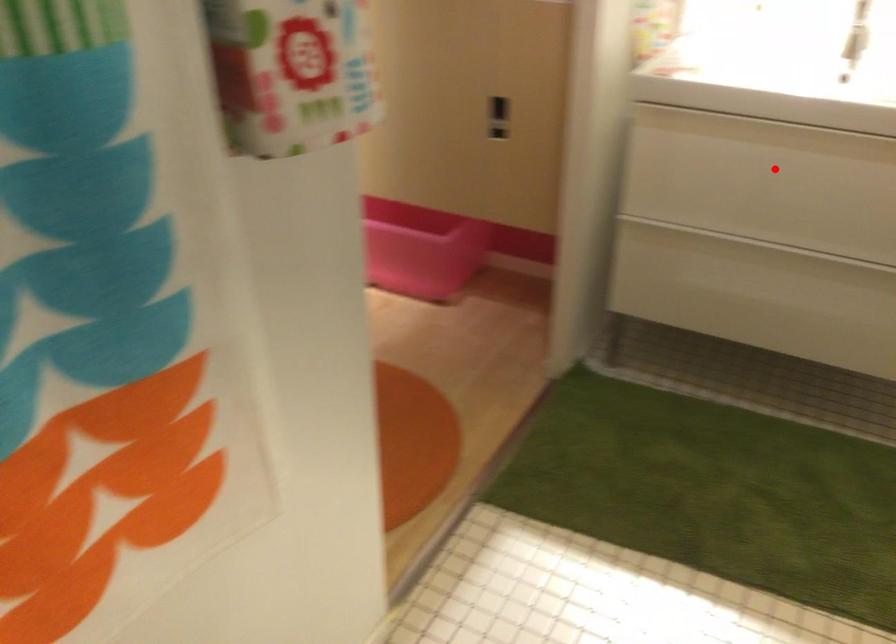
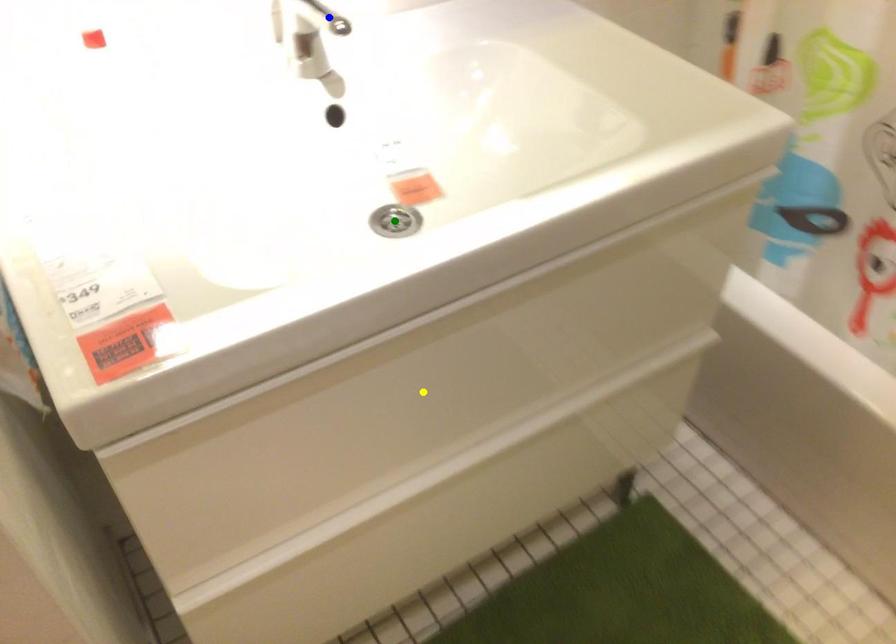
Question: I am providing you with two images of the same scene from different viewpoints. A red point is marked on the first image. You are given multiple points on the second image. Which spot in image 2 lines up with the point in image 1?

Choices:
 (A) yellow point
 (B) blue point
 (C) green point

Answer: (A)